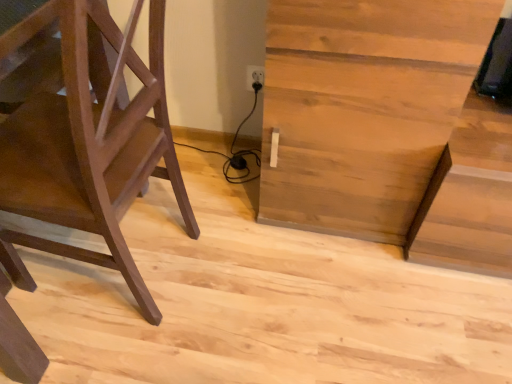
This screenshot has width=512, height=384. Describe the element at coordinates (362, 108) in the screenshot. I see `light brown wood table at center` at that location.

Where is `light brown wood table at center`? The height and width of the screenshot is (384, 512). light brown wood table at center is located at coordinates (362, 108).

Image resolution: width=512 pixels, height=384 pixels. What do you see at coordinates (88, 141) in the screenshot?
I see `matte brown ladder at left` at bounding box center [88, 141].

You are a GUI agent. You are given a task and a screenshot of the screen. Output one action in this format:
    pyautogui.click(x=<x>, y=<y>)
    Task: Click on the matte brown ladder at left
    The image size is (512, 384).
    Given the screenshot: What is the action you would take?
    pyautogui.click(x=88, y=141)

Locate an element on the screen. The height and width of the screenshot is (384, 512). light brown wood table at center is located at coordinates (362, 108).

In the image, is matte brown ladder at left on the left side or the right side of light brown wood table at center?

matte brown ladder at left is positioned on light brown wood table at center's left side.

In the scene shown: Considering the positions of objects matte brown ladder at left and light brown wood table at center in the image provided, who is in front, matte brown ladder at left or light brown wood table at center?

matte brown ladder at left.

Which is behind, point (123, 55) or point (464, 0)?

The point (464, 0) is farther from the camera.

From the image's perspective, which is above, matte brown ladder at left or light brown wood table at center?

light brown wood table at center.

From a real-world perspective, between matte brown ladder at left and light brown wood table at center, who is vertically lower?

light brown wood table at center is physically lower.

Can you confirm if matte brown ladder at left is wider than light brown wood table at center?

Indeed, matte brown ladder at left has a greater width compared to light brown wood table at center.

Between matte brown ladder at left and light brown wood table at center, which one has less height?

light brown wood table at center is shorter.

Looking at the image, does matte brown ladder at left seem bigger or smaller compared to light brown wood table at center?

Clearly, matte brown ladder at left is smaller in size than light brown wood table at center.

Which is correct: matte brown ladder at left is inside light brown wood table at center, or outside of it?

matte brown ladder at left exists outside the volume of light brown wood table at center.

Is matte brown ladder at left directly adjacent to light brown wood table at center?

No, matte brown ladder at left is not beside light brown wood table at center.

Is matte brown ladder at left facing away from light brown wood table at center?

No, matte brown ladder at left is not facing away from light brown wood table at center.

Image resolution: width=512 pixels, height=384 pixels. What are the coordinates of `table above the matte brown ladder at left (from the image's perspective)` in the screenshot? It's located at (362, 108).

Considering the relative positions of light brown wood table at center and matte brown ladder at left in the image provided, is light brown wood table at center to the left of matte brown ladder at left from the viewer's perspective?

In fact, light brown wood table at center is to the right of matte brown ladder at left.

Between light brown wood table at center and matte brown ladder at left, which one is positioned in front?

matte brown ladder at left is in front.

Is point (360, 67) farther from camera compared to point (42, 117)?

No, it is in front of (42, 117).

From the image's perspective, is light brown wood table at center positioned above or below matte brown ladder at left?

light brown wood table at center is above matte brown ladder at left.

From a real-world perspective, is light brown wood table at center physically above matte brown ladder at left?

Incorrect, from a real-world perspective, light brown wood table at center is lower than matte brown ladder at left.

Considering the relative sizes of light brown wood table at center and matte brown ladder at left in the image provided, is light brown wood table at center wider than matte brown ladder at left?

In fact, light brown wood table at center might be narrower than matte brown ladder at left.

Considering the relative sizes of light brown wood table at center and matte brown ladder at left in the image provided, is light brown wood table at center shorter than matte brown ladder at left?

Correct, light brown wood table at center is not as tall as matte brown ladder at left.

Which of these two, light brown wood table at center or matte brown ladder at left, is bigger?

With larger size is light brown wood table at center.

Is matte brown ladder at left inside light brown wood table at center?

No.

Is light brown wood table at center next to matte brown ladder at left and touching it?

No.

Is light brown wood table at center positioned with its back to matte brown ladder at left?

That's not correct — light brown wood table at center is not looking away from matte brown ladder at left.

What's the angular difference between light brown wood table at center and matte brown ladder at left's facing directions?

They differ by 92.2 degrees in their facing directions.

Measure the distance between light brown wood table at center and matte brown ladder at left.

light brown wood table at center is 48.61 centimeters away from matte brown ladder at left.

Identify the location of table on the right side of matte brown ladder at left. (362, 108).

At what (x,y) coordinates should I click in order to perform the action: click on furniture below the light brown wood table at center (from the image's perspective). Please return your answer as a coordinate pair (x, y). The height and width of the screenshot is (384, 512). Looking at the image, I should click on (88, 141).

I want to click on table that appears above the matte brown ladder at left (from the image's perspective), so click(362, 108).